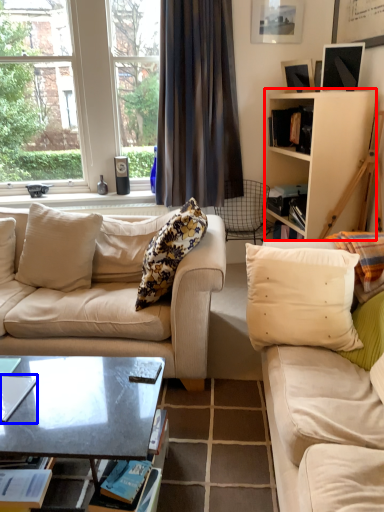
Question: Among these objects, which one is farthest to the camera, cabinetry (highlighted by a red box) or magazine (highlighted by a blue box)?

Choices:
 (A) cabinetry
 (B) magazine

Answer: (A)